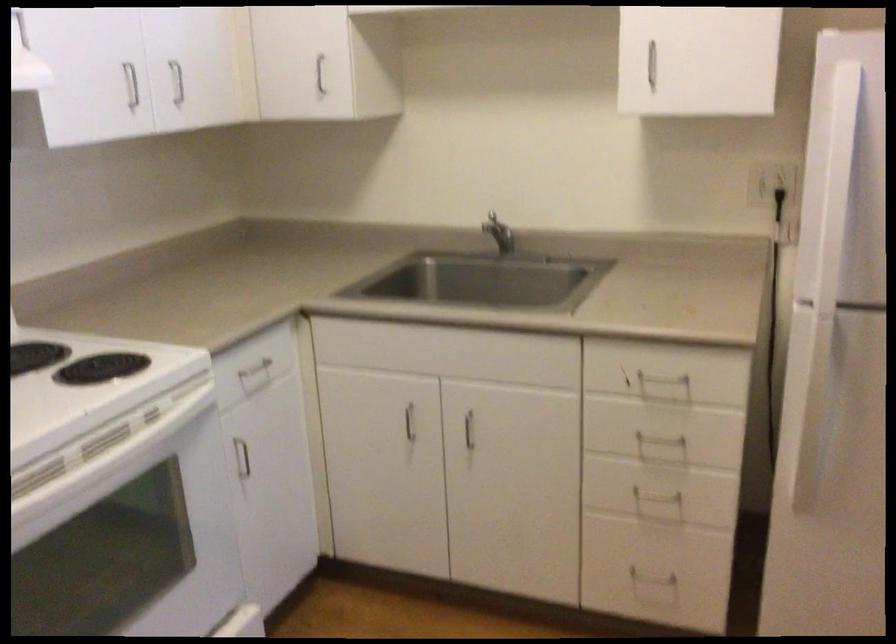
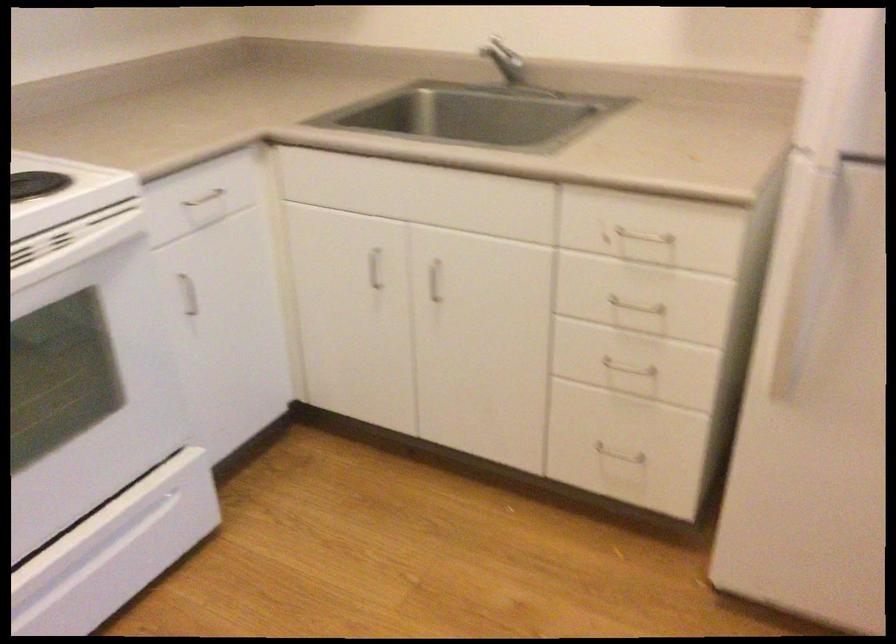
Where in the second image is the point corresponding to the point at 505,236 from the first image?

(510, 68)